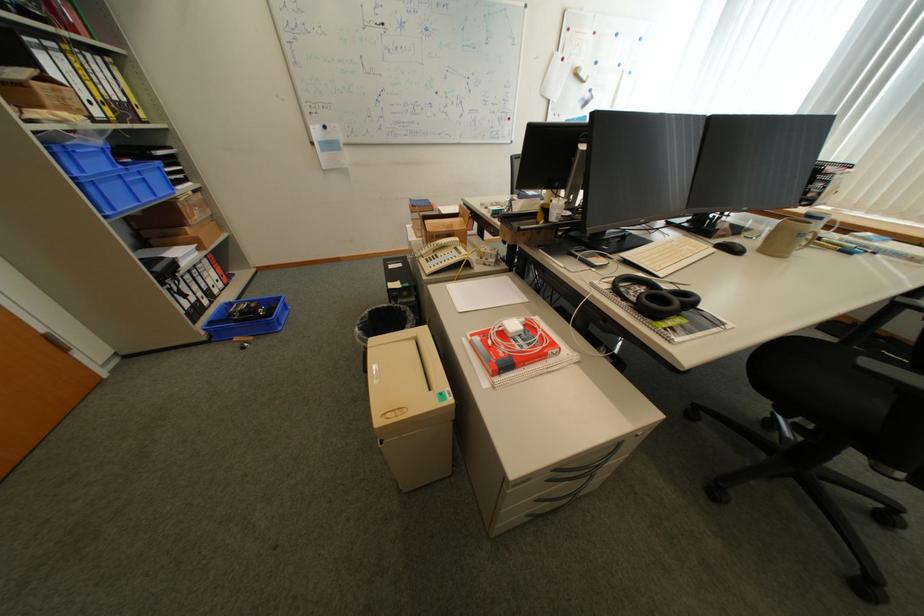
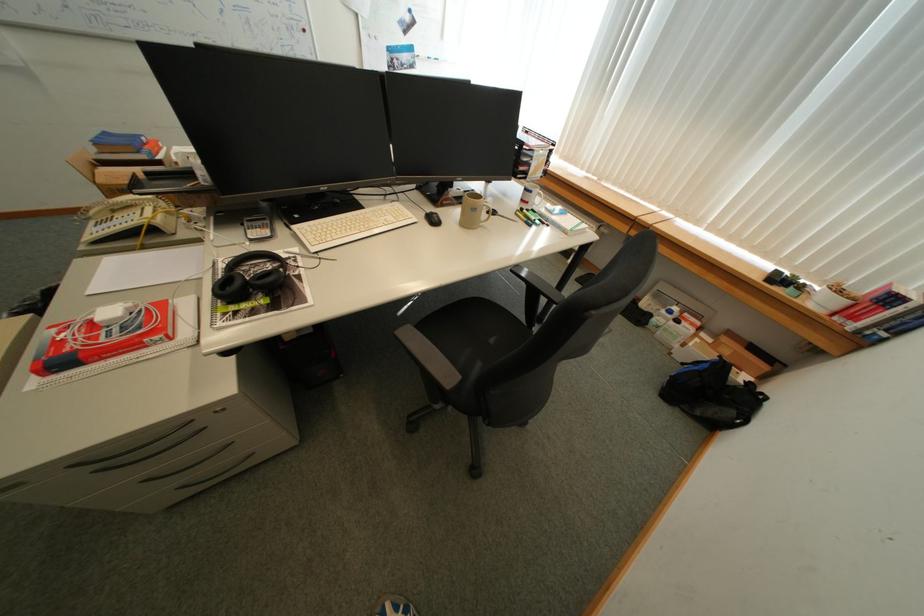
Locate, in the second image, the point that corresponds to point 531,321 in the first image.

(140, 305)